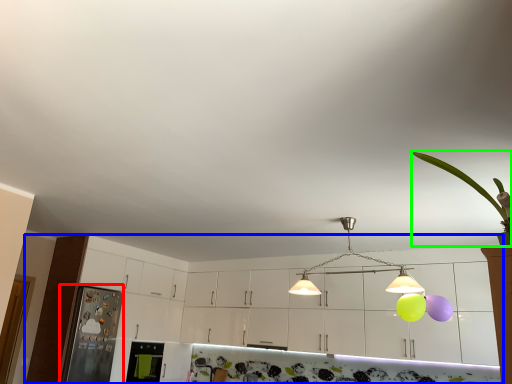
Question: Which object is the closest to the appliance (highlighted by a red box)? Choose among these: cabinetry (highlighted by a blue box) or plant (highlighted by a green box).

Choices:
 (A) cabinetry
 (B) plant

Answer: (A)